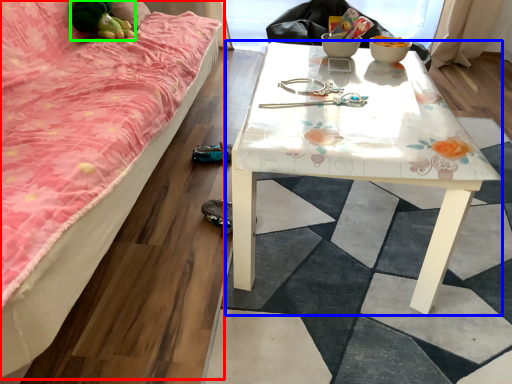
Question: Which object is the farthest from studio couch (highlighted by a red box)? Choose among these: table (highlighted by a blue box) or toy (highlighted by a green box).

Choices:
 (A) table
 (B) toy

Answer: (B)